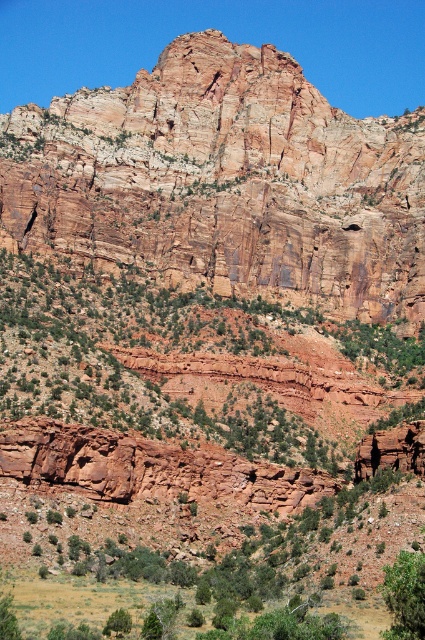
You are standing at the point marked by point (x=223, y=182). Looking towards the towering red rock formation at center, which direction should you walk to get closer to the rock formation?

Since the point (x=223, y=182) is already at the base of the rustic rock formation at center, you are already at the closest point to the rock formation. There is no need to walk further in any direction to get closer.

You are standing at the base of the towering red rock formation. You see two points marked in the image. Which point is closer to you, point (209, 148) or point (388, 636)?

Point (388, 636) is closer to you because point (209, 148) is behind it.